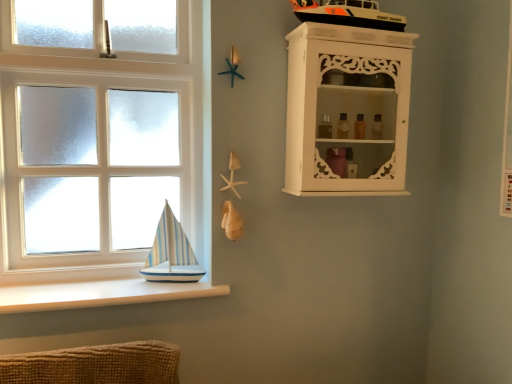
Question: Does white wooden window at left have a greater width compared to white carved cabinet at upper right?

Choices:
 (A) no
 (B) yes

Answer: (A)

Question: Could you tell me if white wooden window at left is facing white carved cabinet at upper right?

Choices:
 (A) yes
 (B) no

Answer: (B)

Question: Is white wooden window at left closer to camera compared to white carved cabinet at upper right?

Choices:
 (A) no
 (B) yes

Answer: (A)

Question: Is white wooden window at left next to white carved cabinet at upper right and touching it?

Choices:
 (A) yes
 (B) no

Answer: (B)

Question: Considering the relative positions of white wooden window at left and white carved cabinet at upper right in the image provided, is white wooden window at left to the left of white carved cabinet at upper right from the viewer's perspective?

Choices:
 (A) no
 (B) yes

Answer: (B)

Question: From a real-world perspective, is white wooden window at left located higher than white carved cabinet at upper right?

Choices:
 (A) no
 (B) yes

Answer: (A)

Question: Can you confirm if white carved cabinet at upper right is thinner than white wooden window at left?

Choices:
 (A) yes
 (B) no

Answer: (B)

Question: Can you confirm if white carved cabinet at upper right is bigger than white wooden window at left?

Choices:
 (A) yes
 (B) no

Answer: (B)

Question: Does white carved cabinet at upper right come behind white wooden window at left?

Choices:
 (A) no
 (B) yes

Answer: (A)

Question: Is white carved cabinet at upper right not close to white wooden window at left?

Choices:
 (A) no
 (B) yes

Answer: (A)

Question: Is white carved cabinet at upper right at the left side of white wooden window at left?

Choices:
 (A) no
 (B) yes

Answer: (A)

Question: Is white carved cabinet at upper right outside white wooden window at left?

Choices:
 (A) yes
 (B) no

Answer: (A)

Question: Is the surface of white smooth ledge at lower left in direct contact with white wooden window at left?

Choices:
 (A) yes
 (B) no

Answer: (B)